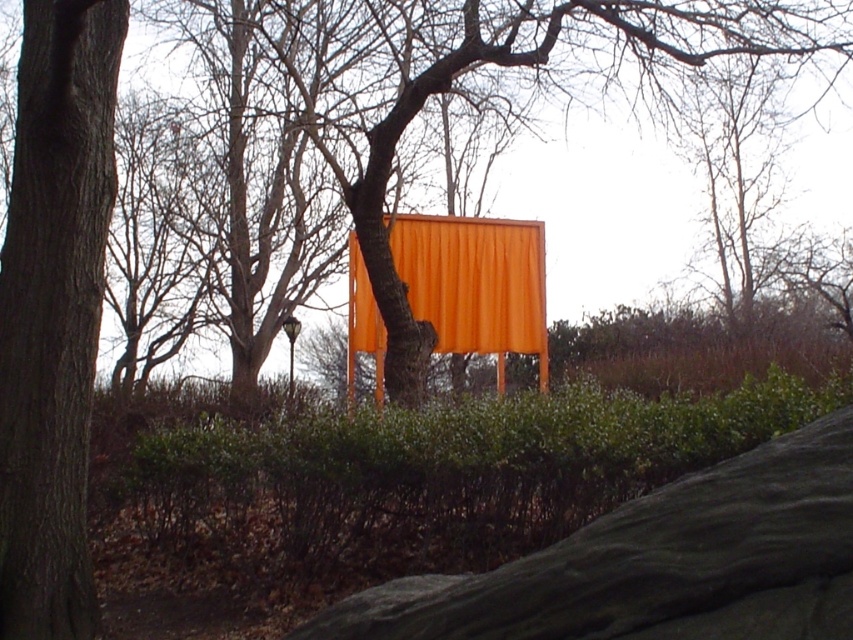
Question: Among these points, which one is nearest to the camera?

Choices:
 (A) (80, 493)
 (B) (396, 250)
 (C) (821, 524)

Answer: (C)

Question: Is smooth gray rock at center closer to camera compared to orange matte curtain at center?

Choices:
 (A) yes
 (B) no

Answer: (A)

Question: Does smooth gray rock at center come in front of smooth brown tree trunk at left?

Choices:
 (A) no
 (B) yes

Answer: (B)

Question: Considering the relative positions of smooth brown tree trunk at left and orange matte curtain at center in the image provided, where is smooth brown tree trunk at left located with respect to orange matte curtain at center?

Choices:
 (A) below
 (B) above

Answer: (A)

Question: Which is farther from the smooth brown tree trunk at left?

Choices:
 (A) orange matte curtain at center
 (B) smooth gray rock at center

Answer: (A)

Question: Which of the following is the farthest from the observer?

Choices:
 (A) (10, 285)
 (B) (447, 241)
 (C) (579, 625)

Answer: (B)